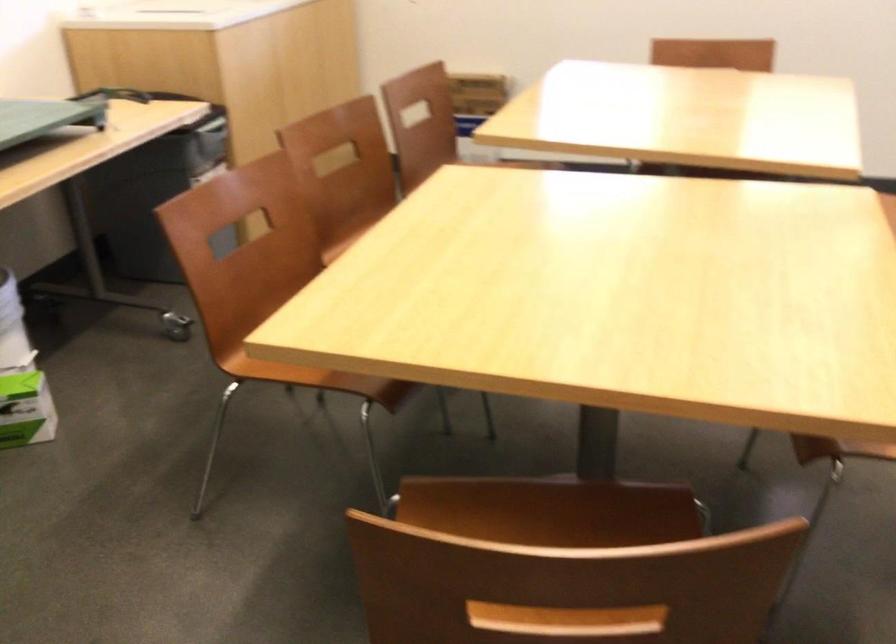
Question: The camera is either moving clockwise (left) or counter-clockwise (right) around the object. The first image is from the beginning of the video and the second image is from the end. Is the camera moving left or right when shooting the video?

Choices:
 (A) Left
 (B) Right

Answer: (A)